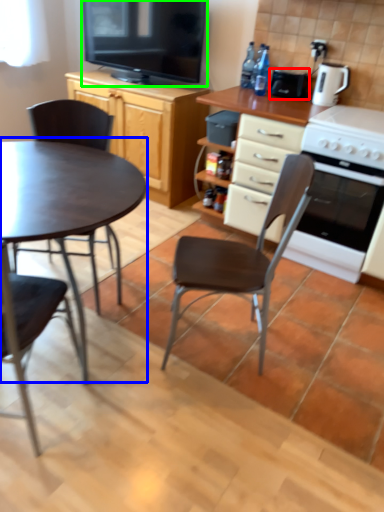
Question: Considering the real-world distances, which object is closest to appliance (highlighted by a red box)? coffee table (highlighted by a blue box) or television (highlighted by a green box).

Choices:
 (A) coffee table
 (B) television

Answer: (B)